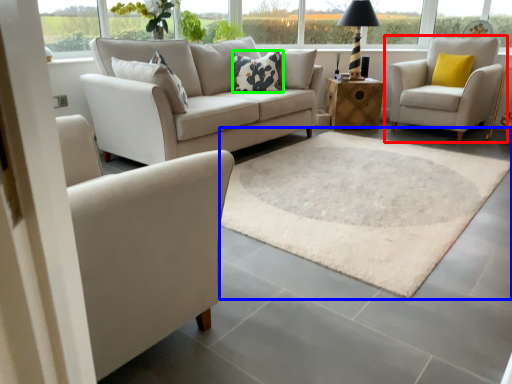
Question: Estimate the real-world distances between objects in this image. Which object is farther from chair (highlighted by a red box), mat (highlighted by a blue box) or pillow (highlighted by a green box)?

Choices:
 (A) mat
 (B) pillow

Answer: (B)